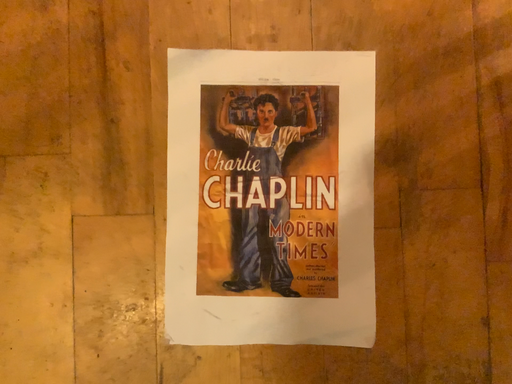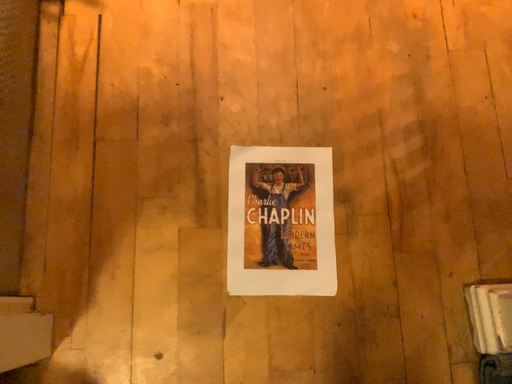
Question: How did the camera likely rotate when shooting the video?

Choices:
 (A) rotated upward
 (B) rotated downward

Answer: (A)